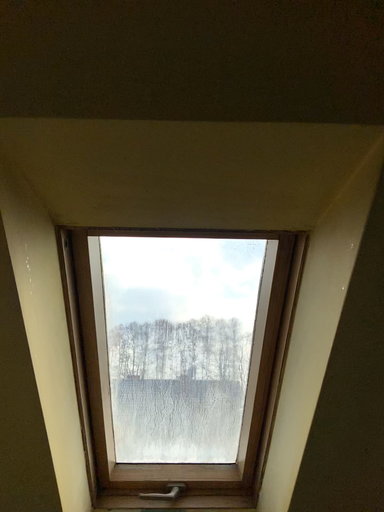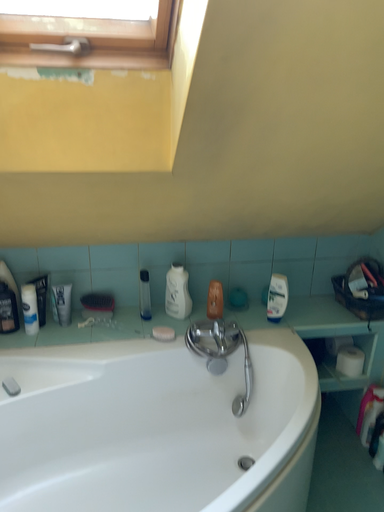
Question: Which way did the camera rotate in the video?

Choices:
 (A) rotated upward
 (B) rotated downward

Answer: (B)